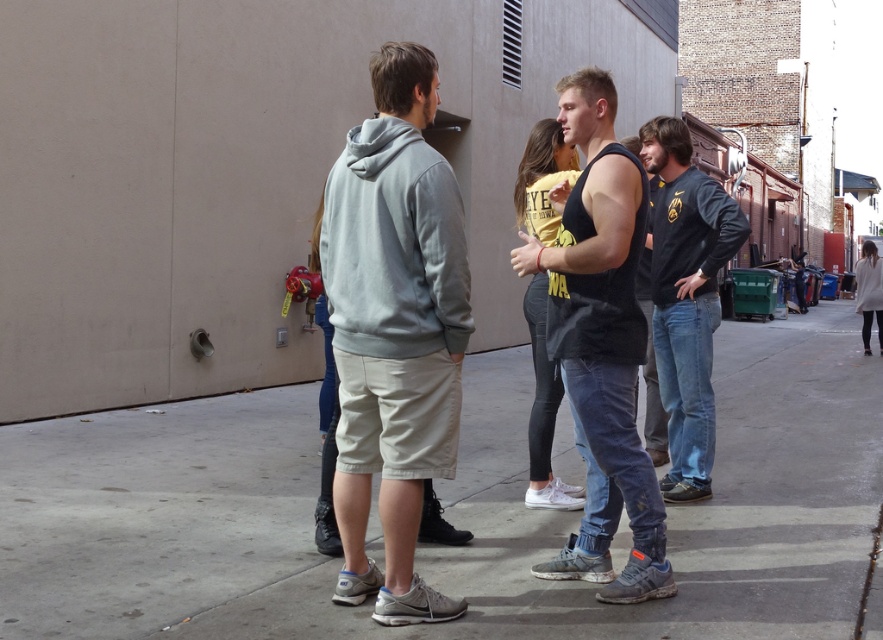
Is light gray hoodie at center thinner than light gray sweater at right?

No.

Measure the distance between light gray hoodie at center and camera.

The distance of light gray hoodie at center from camera is 4.09 meters.

Locate an element on the screen. light gray hoodie at center is located at coordinates [394, 330].

Can you confirm if matte gray hoodie at center is smaller than dark gray sweatshirt at right?

Yes, matte gray hoodie at center is smaller than dark gray sweatshirt at right.

Can you confirm if matte gray hoodie at center is positioned above dark gray sweatshirt at right?

Incorrect, matte gray hoodie at center is not positioned above dark gray sweatshirt at right.

The image size is (883, 640). Describe the element at coordinates (602, 348) in the screenshot. I see `matte gray hoodie at center` at that location.

This screenshot has width=883, height=640. What are the coordinates of `matte gray hoodie at center` in the screenshot? It's located at (602, 348).

Is light gray hoodie at center shorter than matte yellow t-shirt at center?

Incorrect, light gray hoodie at center's height does not fall short of matte yellow t-shirt at center's.

Consider the image. Is light gray hoodie at center further to the viewer compared to matte yellow t-shirt at center?

That is False.

Which is behind, point (387, 67) or point (540, 419)?

The point (540, 419) is behind.

Where is `light gray hoodie at center`? The width and height of the screenshot is (883, 640). light gray hoodie at center is located at coordinates (394, 330).